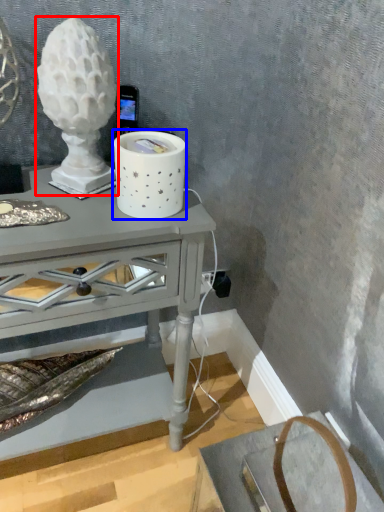
Question: Which of the following is the farthest to the observer, candle holder (highlighted by a red box) or candle holder (highlighted by a blue box)?

Choices:
 (A) candle holder
 (B) candle holder

Answer: (B)